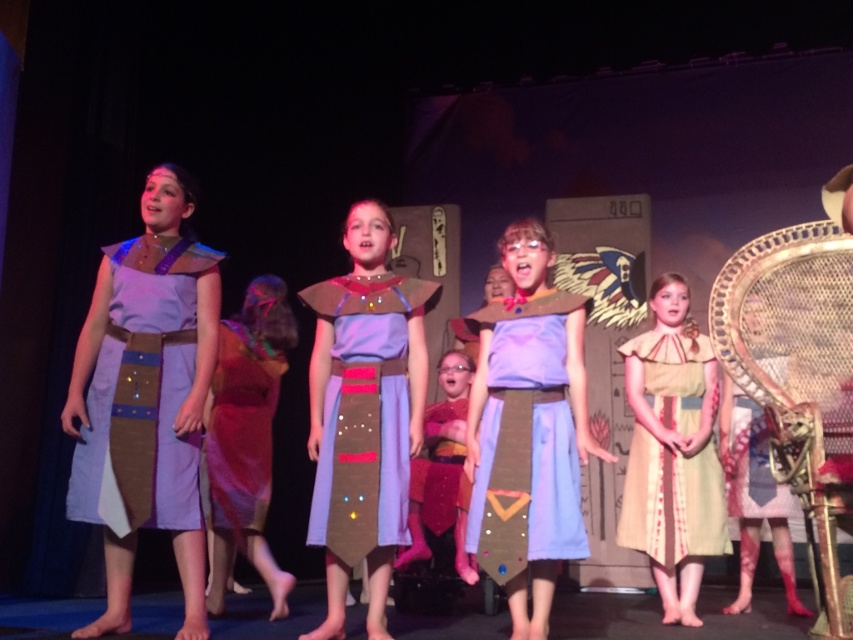
Who is more forward, (144, 355) or (389, 356)?

Positioned in front is point (144, 355).

Which is above, matte purple fabric dress at left or matte fabric dress at center?

matte purple fabric dress at left is above.

At what (x,y) coordinates should I click in order to perform the action: click on matte purple fabric dress at left. Please return your answer as a coordinate pair (x, y). Looking at the image, I should click on (142, 392).

Can you confirm if matte purple fabric dress at left is smaller than light blue fabric dress at center?

Yes, matte purple fabric dress at left is smaller than light blue fabric dress at center.

What do you see at coordinates (142, 392) in the screenshot? This screenshot has width=853, height=640. I see `matte purple fabric dress at left` at bounding box center [142, 392].

Image resolution: width=853 pixels, height=640 pixels. Find the location of `matte purple fabric dress at left`. matte purple fabric dress at left is located at coordinates (142, 392).

Who is more forward, (543, 307) or (346, 346)?

Point (346, 346) is more forward.

Is point (582, 532) positioned before point (334, 417)?

Yes, it is.

I want to click on light blue fabric dress at center, so click(525, 440).